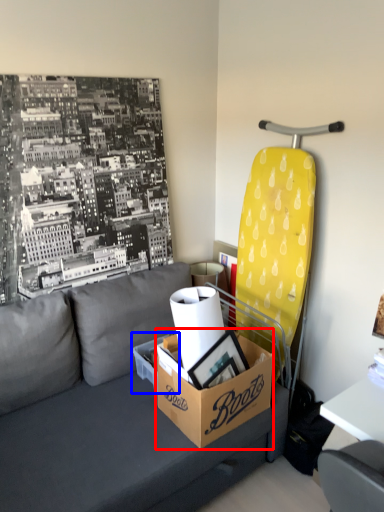
Question: Among these objects, which one is farthest to the camera, box (highlighted by a red box) or cardboard box (highlighted by a blue box)?

Choices:
 (A) box
 (B) cardboard box

Answer: (B)